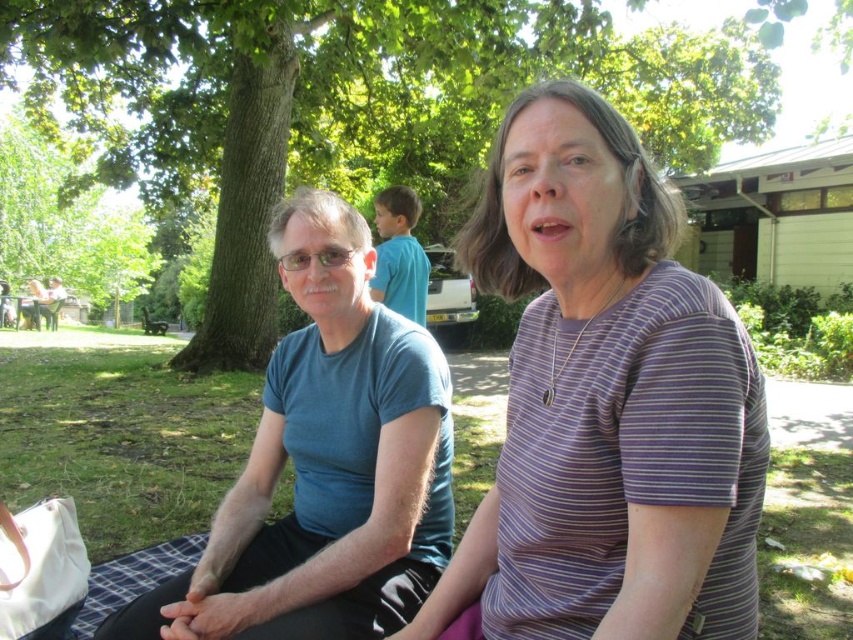
Question: Which object appears farthest from the camera in this image?

Choices:
 (A) green leafy tree at center
 (B) purple striped shirt at center

Answer: (A)

Question: From the image, what is the correct spatial relationship of purple striped shirt at center in relation to green leafy tree at center?

Choices:
 (A) right
 (B) left

Answer: (A)

Question: Is purple striped shirt at center to the right of green leafy tree at center from the viewer's perspective?

Choices:
 (A) no
 (B) yes

Answer: (B)

Question: Can you confirm if purple striped shirt at center is positioned to the left of green leafy tree at center?

Choices:
 (A) yes
 (B) no

Answer: (B)